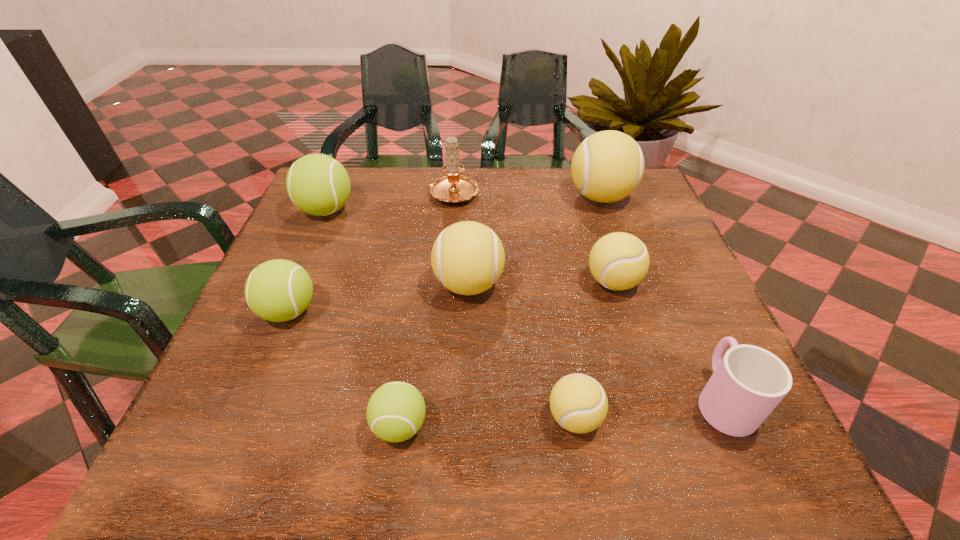
The image size is (960, 540). What are the coordinates of `free space between the second smallest yellow tennis ball and the candle` in the screenshot? It's located at (534, 237).

Locate an element on the screen. The height and width of the screenshot is (540, 960). free space between the second farthest green tennis ball and the cup is located at coordinates (506, 355).

Image resolution: width=960 pixels, height=540 pixels. I want to click on empty space that is in between the farthest yellow tennis ball and the candle, so click(528, 194).

What are the coordinates of `vacant space in between the farthest green tennis ball and the smallest green tennis ball` in the screenshot? It's located at (363, 318).

Identify which object is located as the second nearest to the second nearest green tennis ball. Please provide its 2D coordinates. Your answer should be formatted as a tuple, i.e. [(x, y)], where the tuple contains the x and y coordinates of a point satisfying the conditions above.

[(317, 184)]

Where is `object that is the sixth closest to the biggest yellow tennis ball`? object that is the sixth closest to the biggest yellow tennis ball is located at coordinates (317, 184).

Where is `tennis ball object that ranks as the fifth closest to the cup`? tennis ball object that ranks as the fifth closest to the cup is located at coordinates (607, 166).

Select which tennis ball appears as the third closest to the cup. Please provide its 2D coordinates. Your answer should be formatted as a tuple, i.e. [(x, y)], where the tuple contains the x and y coordinates of a point satisfying the conditions above.

[(467, 257)]

Locate which yellow tennis ball is the second closest to the rightmost green tennis ball. Please provide its 2D coordinates. Your answer should be formatted as a tuple, i.e. [(x, y)], where the tuple contains the x and y coordinates of a point satisfying the conditions above.

[(467, 257)]

Identify which yellow tennis ball is located as the second nearest to the third tennis ball from right to left. Please provide its 2D coordinates. Your answer should be formatted as a tuple, i.e. [(x, y)], where the tuple contains the x and y coordinates of a point satisfying the conditions above.

[(619, 261)]